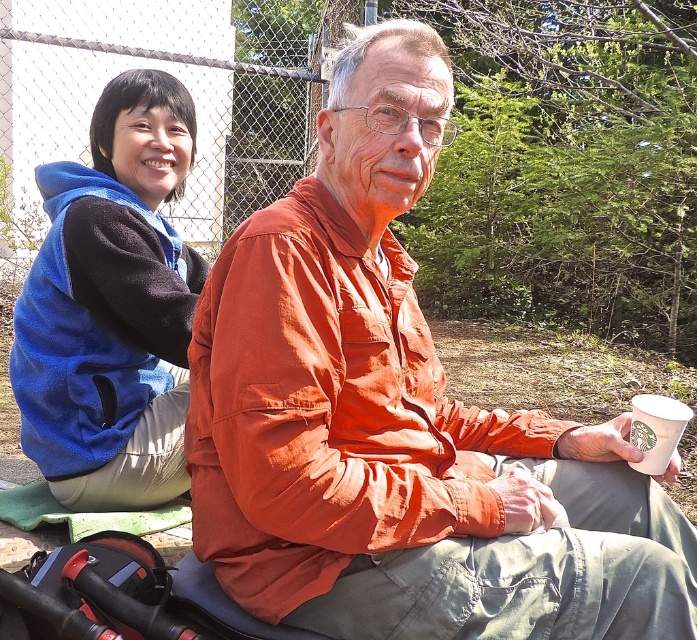
You are planning to take a photo of the orange cotton shirt at center and the blue fleece vest at upper left. Which one should you zoom in on to capture more details of the clothing patterns?

The orange cotton shirt at center has a larger size compared to the blue fleece vest at upper left, so zooming in on the orange cotton shirt at center will allow you to capture more details of its clothing patterns.

You are standing in a park and see two people. The woman on the left is wearing a blue vest over a black long sleeve shirt and beige pants. The man on the right is wearing an orange long sleeve shirt and olive green pants. He is holding a white coffee cup. There is a point marked at coordinate (399,419). Which person is located at that coordinate?

The orange cotton shirt at center is located at point (399,419).

You are standing in the park where the two people are sitting. You notice two points in the image. The first point is at coordinates point (x=20, y=364) and the second point is at point (x=671, y=412). Which point is closer to you?

Point (x=20, y=364) is closer to you because it is further to the viewer than point (x=671, y=412).